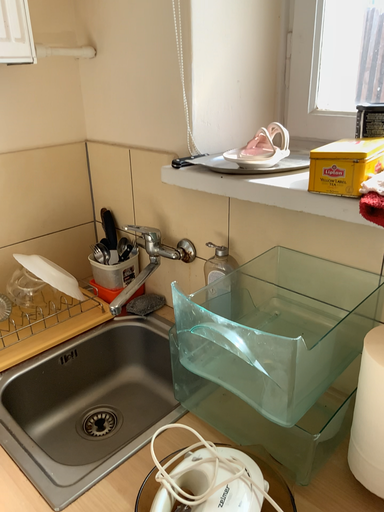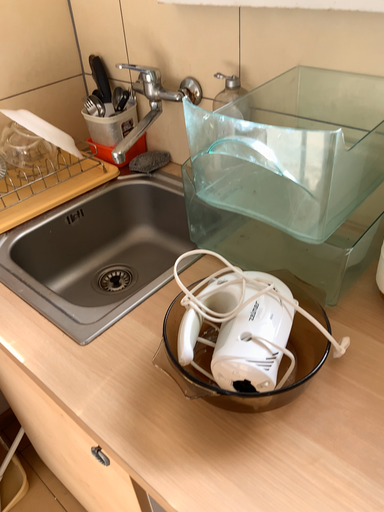
Question: How did the camera likely rotate when shooting the video?

Choices:
 (A) rotated downward
 (B) rotated upward

Answer: (A)